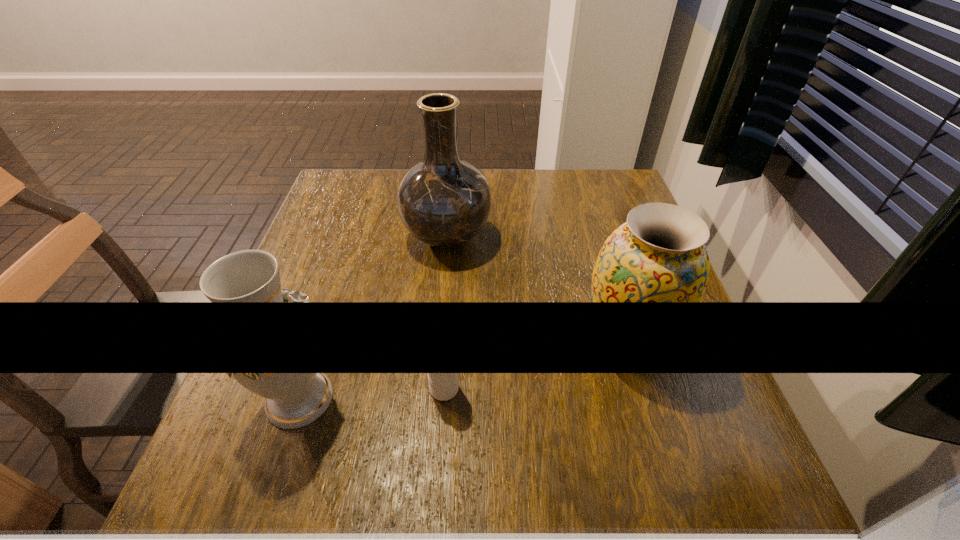
Image resolution: width=960 pixels, height=540 pixels. In the image, there is a desktop. What are the coordinates of `vacant space at the far edge` in the screenshot? It's located at (512, 177).

Where is `vacant space at the near edge`? The image size is (960, 540). vacant space at the near edge is located at coordinates (628, 520).

Image resolution: width=960 pixels, height=540 pixels. I want to click on free spot at the left edge of the desktop, so click(x=322, y=348).

Identify the location of vacant region at the right edge of the desktop. This screenshot has height=540, width=960. (588, 226).

Locate an element on the screen. Image resolution: width=960 pixels, height=540 pixels. free space at the far left corner is located at coordinates (343, 181).

The width and height of the screenshot is (960, 540). I want to click on vacant space at the far right corner, so click(x=595, y=191).

The height and width of the screenshot is (540, 960). I want to click on vacant space at the near right corner of the desktop, so click(681, 472).

Where is `blank region between the rightmost object and the second object from left to right`? blank region between the rightmost object and the second object from left to right is located at coordinates (537, 288).

Locate an element on the screen. vacant area that lies between the farthest object and the leftmost vase is located at coordinates (373, 316).

Identify the location of vacant space that is in between the farthest vase and the rightmost object. This screenshot has height=540, width=960. (537, 288).